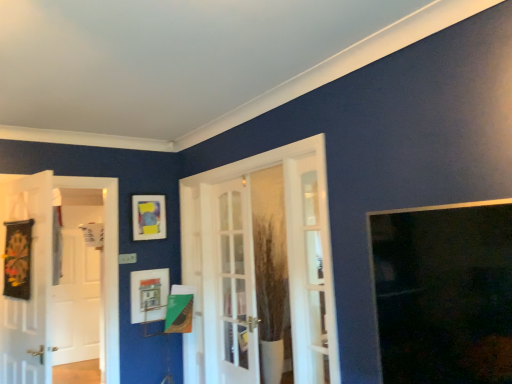
Question: In terms of height, does white glossy screen door at left look taller or shorter compared to transparent glass window at upper right?

Choices:
 (A) tall
 (B) short

Answer: (A)

Question: In the image, is white glossy screen door at left positioned in front of or behind transparent glass window at upper right?

Choices:
 (A) front
 (B) behind

Answer: (B)

Question: Estimate the real-world distances between objects in this image. Which object is closer to the white glass door at center, placed as the 1th door when sorted from right to left?

Choices:
 (A) white glass door at center, the second door viewed from the left
 (B) black fabric banner at left, which is the third door in right-to-left order
 (C) transparent glass window at upper right
 (D) white glossy screen door at left
 (E) matte white picture frame at center, acting as the first picture frame starting from the bottom

Answer: (A)

Question: Considering the real-world distances, which object is farthest from the white glass door at center, which is the 2th door in right-to-left order?

Choices:
 (A) white glossy screen door at left
 (B) matte plastic picture frame at upper left, which is the 1th picture frame in top-to-bottom order
 (C) transparent glass window at upper right
 (D) white glass door at center, the third door in the left-to-right sequence
 (E) black fabric banner at left, which is the third door in right-to-left order

Answer: (A)